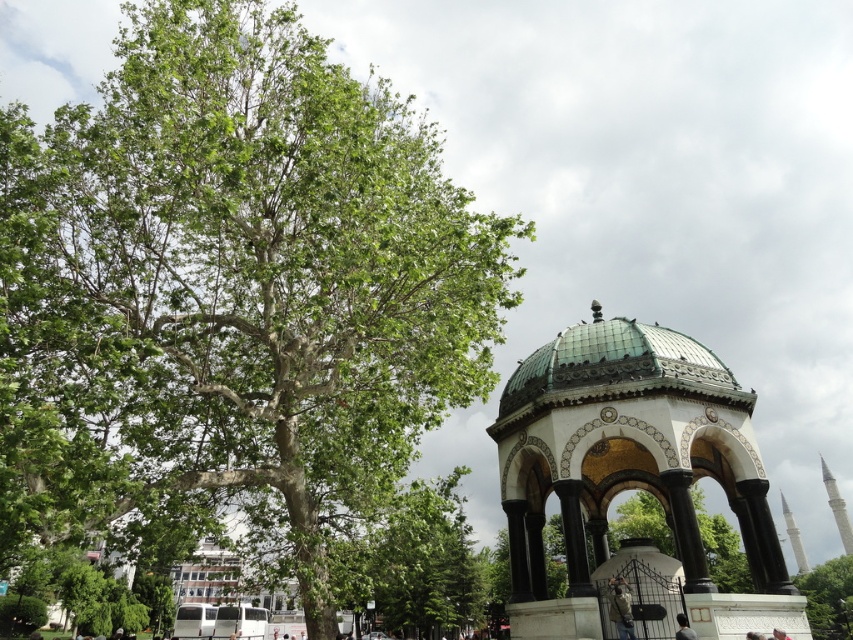
Question: Based on their relative distances, which object is nearer to the khaki fabric jacket at lower right?

Choices:
 (A) green leafy tree at left
 (B) green leafy tree at center

Answer: (A)

Question: Considering the relative positions of green-tiled gazebo at center and khaki fabric jacket at lower right in the image provided, where is green-tiled gazebo at center located with respect to khaki fabric jacket at lower right?

Choices:
 (A) above
 (B) below

Answer: (A)

Question: Which point is closer to the camera?

Choices:
 (A) green leafy tree at left
 (B) khaki fabric jacket at lower right
 (C) green-tiled gazebo at center
 (D) green leafy tree at center

Answer: (A)

Question: Which object is farther from the camera taking this photo?

Choices:
 (A) green leafy tree at center
 (B) green leafy tree at left
 (C) khaki fabric jacket at lower right

Answer: (A)

Question: Does green-tiled gazebo at center have a smaller size compared to green leafy tree at center?

Choices:
 (A) yes
 (B) no

Answer: (B)

Question: Is green leafy tree at center to the left of gray fabric person at lower center from the viewer's perspective?

Choices:
 (A) no
 (B) yes

Answer: (A)